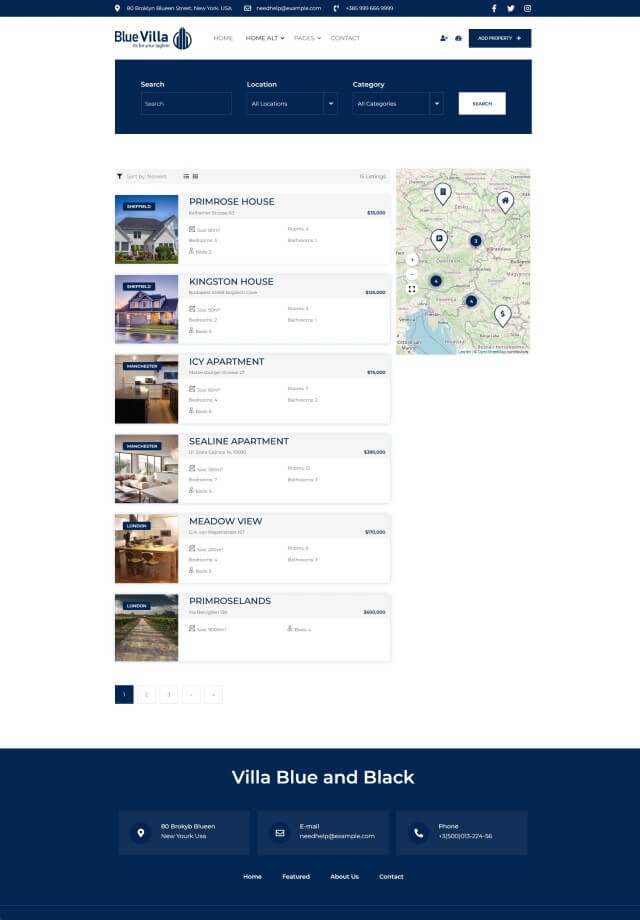
Identify the location of thumbnail image of "meadowview" kitchen. (148, 545).